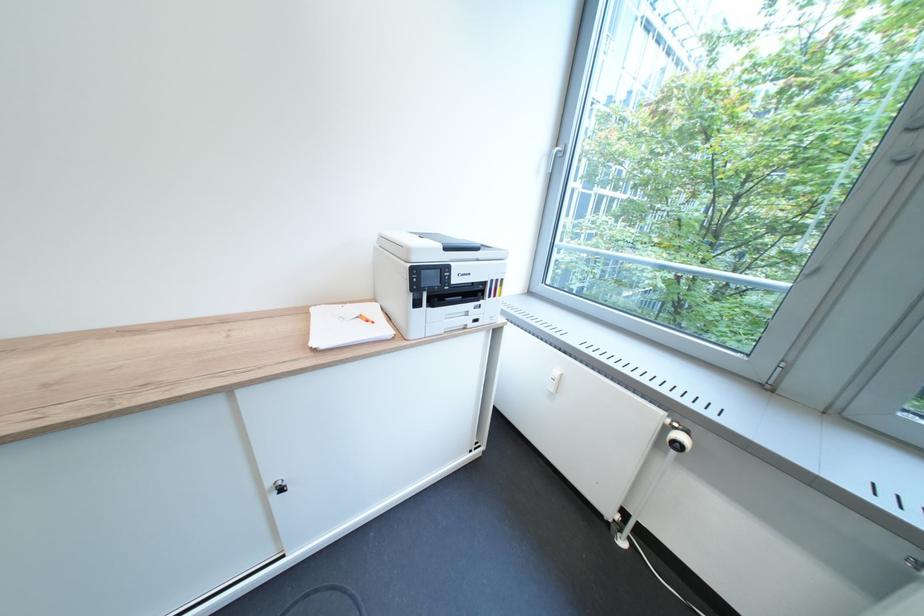
Describe the element at coordinates (450, 241) in the screenshot. I see `a printer scanner lid` at that location.